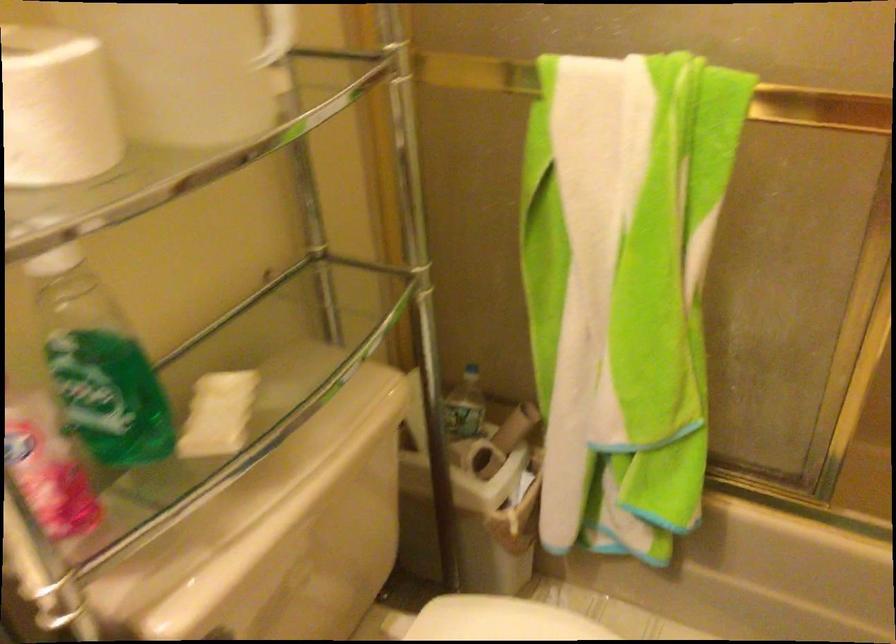
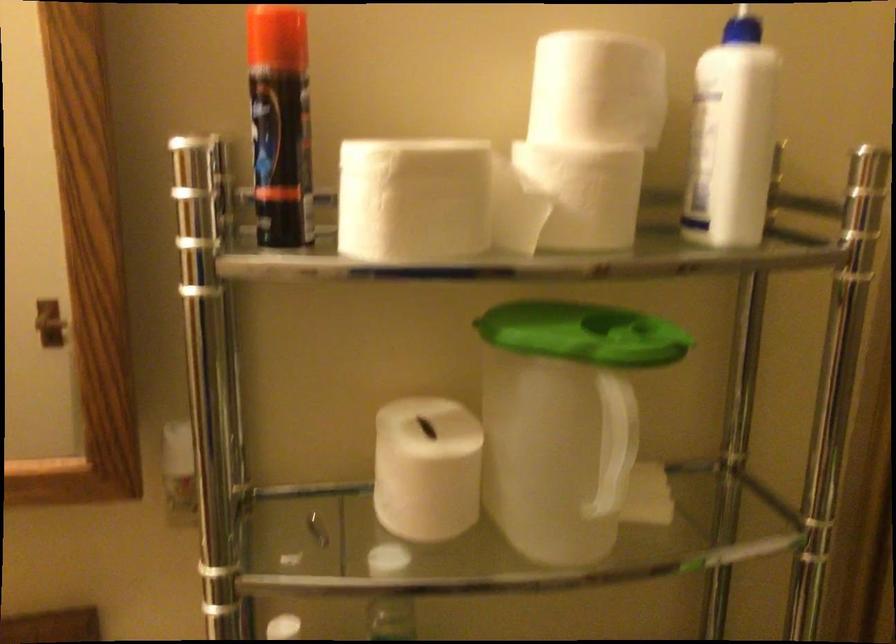
Find the pixel in the second image that matches point (73, 96) in the first image.

(426, 469)